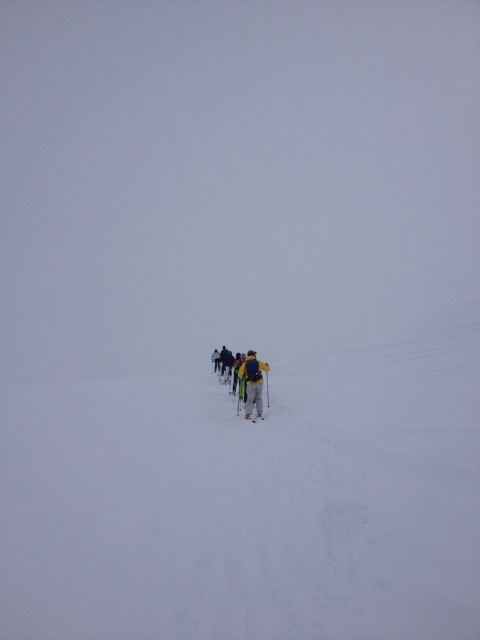
Does yellow fabric backpack at center appear over yellow matte ski at center?

Yes, yellow fabric backpack at center is above yellow matte ski at center.

Describe the element at coordinates (252, 381) in the screenshot. Image resolution: width=480 pixels, height=640 pixels. I see `yellow fabric backpack at center` at that location.

Who is more distant from viewer, (x=243, y=374) or (x=255, y=419)?

Positioned behind is point (x=243, y=374).

Locate an element on the screen. This screenshot has height=640, width=480. yellow fabric backpack at center is located at coordinates (252, 381).